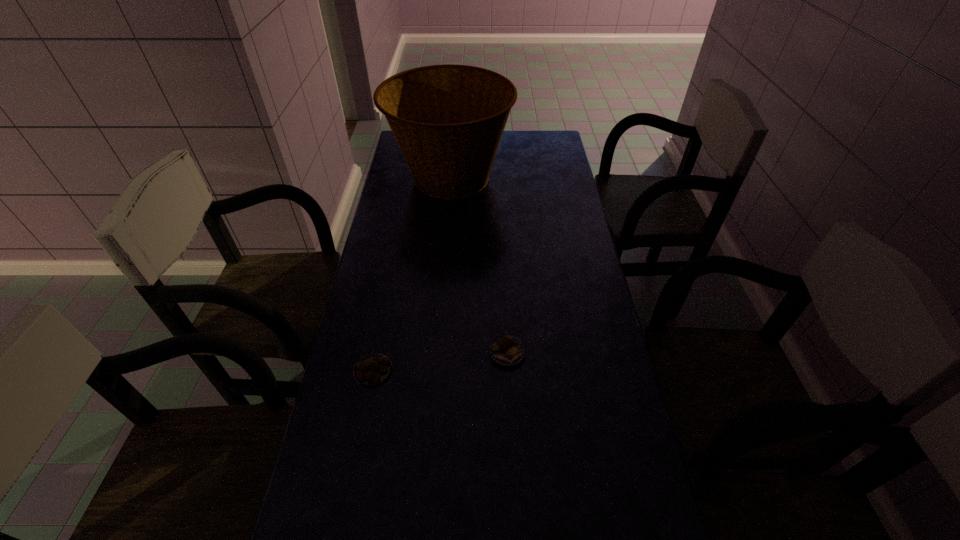
The width and height of the screenshot is (960, 540). What are the coordinates of `free space that satisfies the following two spatial constraints: 1. on the front side of the basket; 2. on the right side of the second tallest object` in the screenshot? It's located at (436, 353).